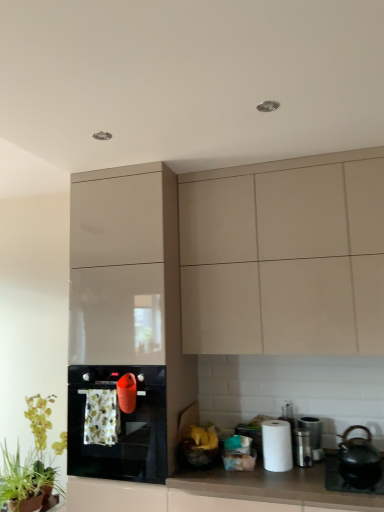
In order to click on blank space to the left of white paper at right in this screenshot , I will do pyautogui.click(x=246, y=476).